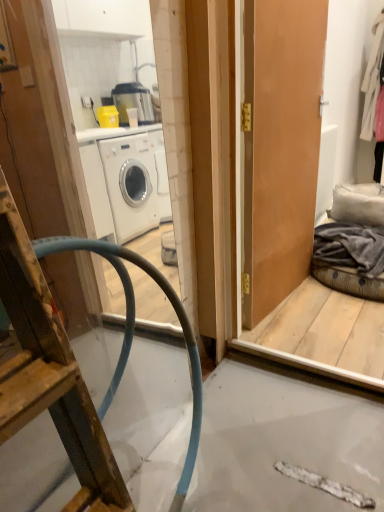
Locate an element on the screen. The image size is (384, 512). vacant location below matte brown door at center (from a real-world perspective) is located at coordinates (288, 298).